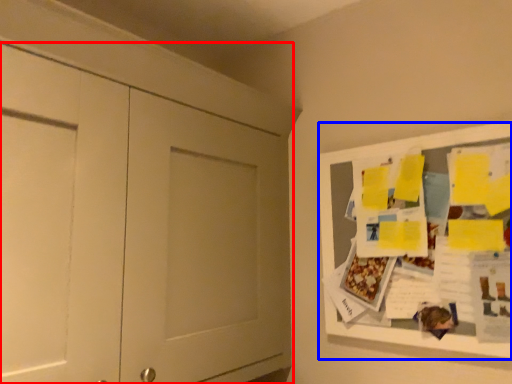
Question: Which point is further to the camera, door (highlighted by a red box) or bulletin board (highlighted by a blue box)?

Choices:
 (A) door
 (B) bulletin board

Answer: (B)